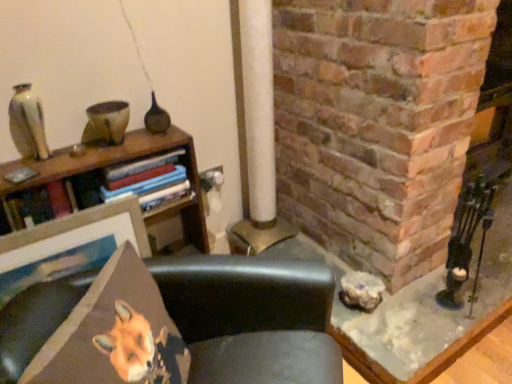
Image resolution: width=512 pixels, height=384 pixels. I want to click on free space in front of matte white vase at upper left, so coord(32,173).